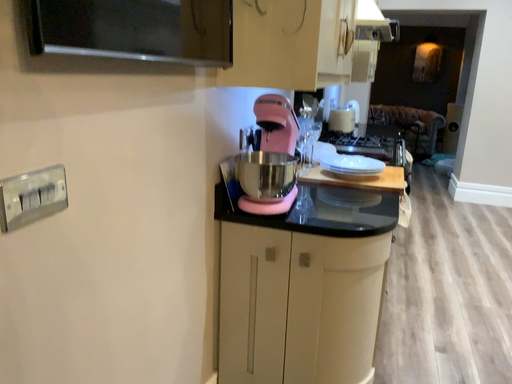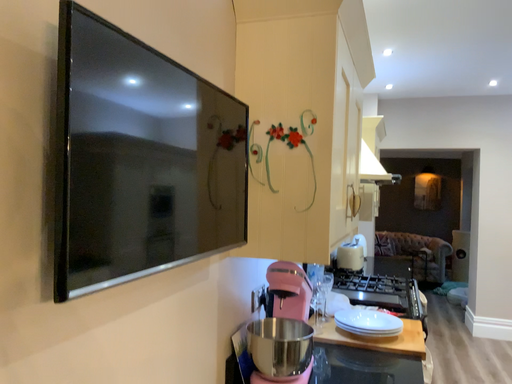
Question: How did the camera likely rotate when shooting the video?

Choices:
 (A) rotated downward
 (B) rotated upward

Answer: (B)